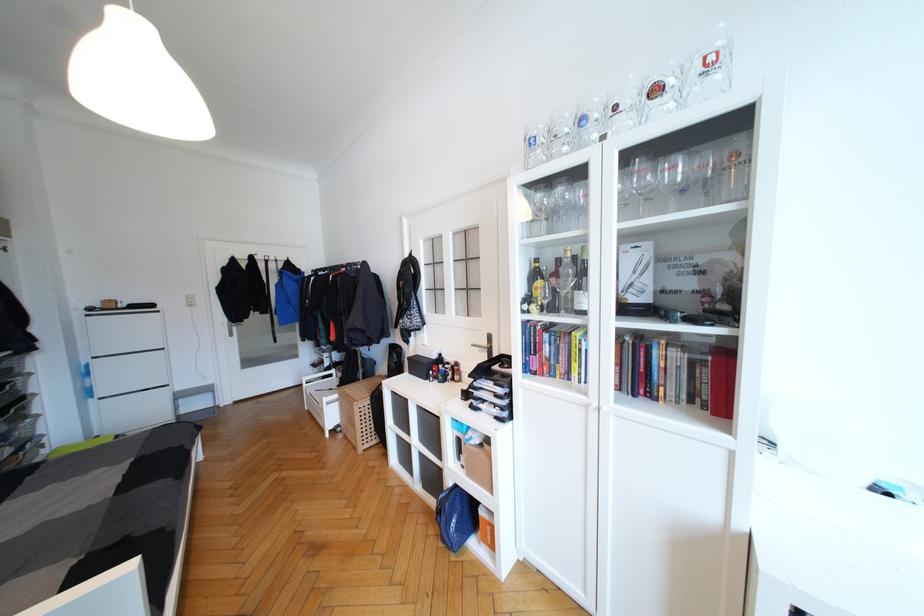
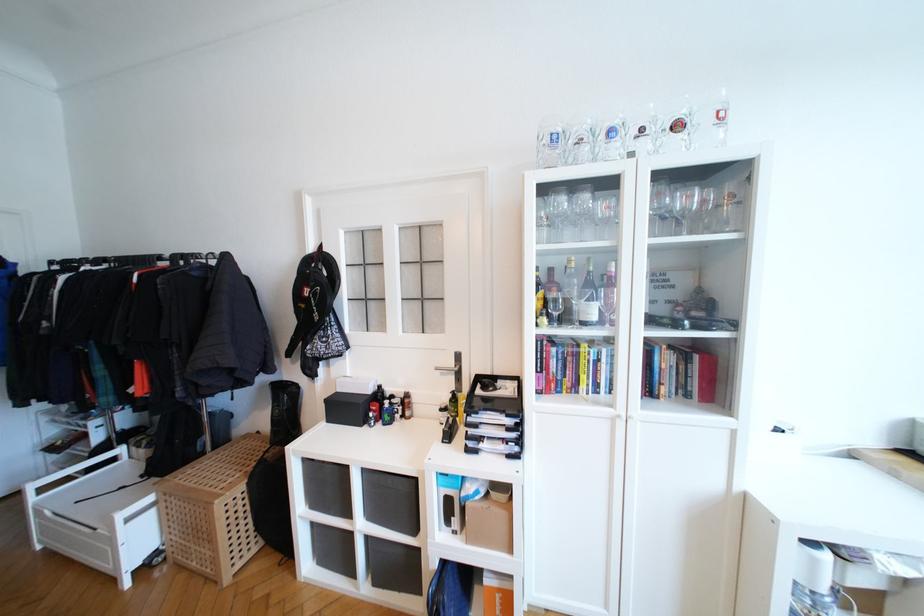
The point at (x=679, y=171) is marked in the first image. Where is the corresponding point in the second image?

(691, 200)